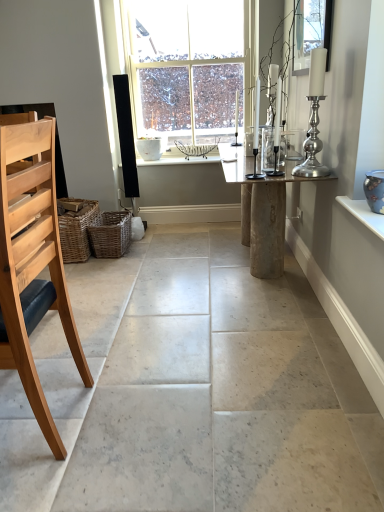
Locate an element on the screen. The image size is (384, 512). free space to the right of woven brown basket at lower left, the 2th basket when ordered from left to right is located at coordinates (153, 249).